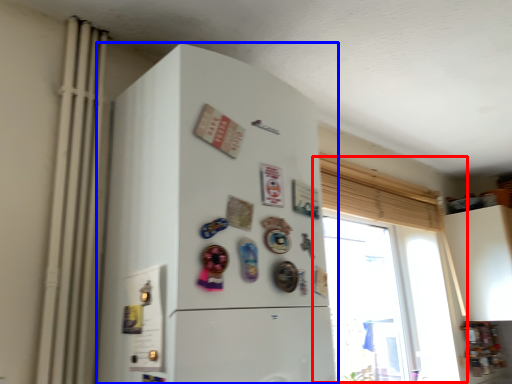
Question: Which point is closer to the camera, window (highlighted by a red box) or refrigerator (highlighted by a blue box)?

Choices:
 (A) window
 (B) refrigerator

Answer: (B)